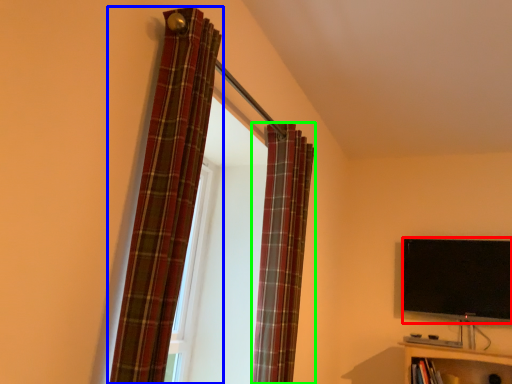
Question: Based on their relative distances, which object is farther from television (highlighted by a red box)? Choose from curtain (highlighted by a blue box) and curtain (highlighted by a green box).

Choices:
 (A) curtain
 (B) curtain

Answer: (A)